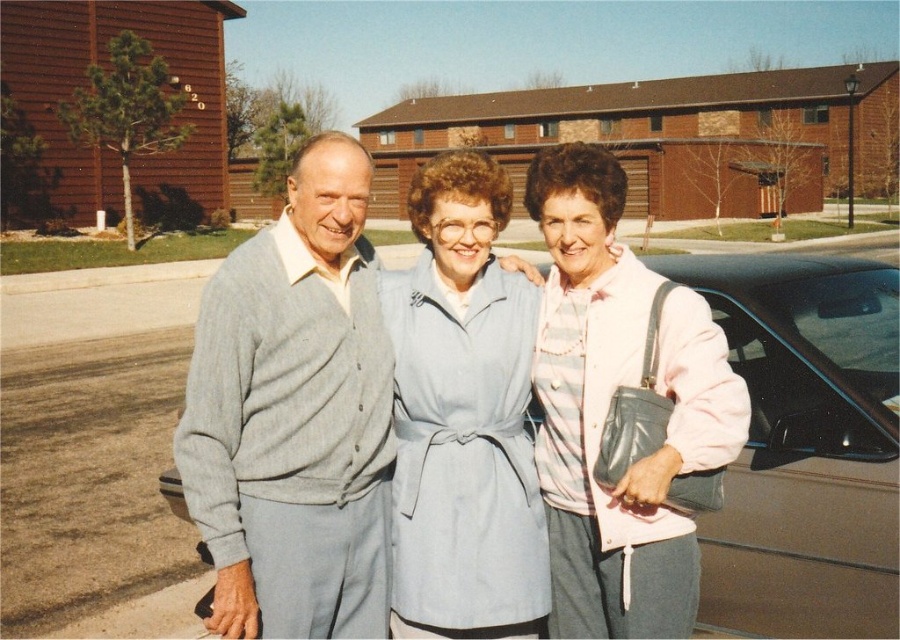
Question: Is gray cardigan at center closer to the viewer compared to pink fabric jacket at center?

Choices:
 (A) yes
 (B) no

Answer: (A)

Question: Which point is farther from the camera taking this photo?

Choices:
 (A) (468, 272)
 (B) (771, 371)

Answer: (B)

Question: In this image, where is gray cardigan at center located relative to metallic gray car at center?

Choices:
 (A) above
 (B) below

Answer: (A)

Question: Estimate the real-world distances between objects in this image. Which object is closer to the gray cardigan at center?

Choices:
 (A) metallic gray car at center
 (B) light blue fabric coat at center

Answer: (B)

Question: Among these objects, which one is nearest to the camera?

Choices:
 (A) gray cardigan at center
 (B) pink fabric jacket at center
 (C) metallic gray car at center
 (D) light blue fabric coat at center

Answer: (A)

Question: Is gray cardigan at center behind light blue fabric coat at center?

Choices:
 (A) yes
 (B) no

Answer: (B)